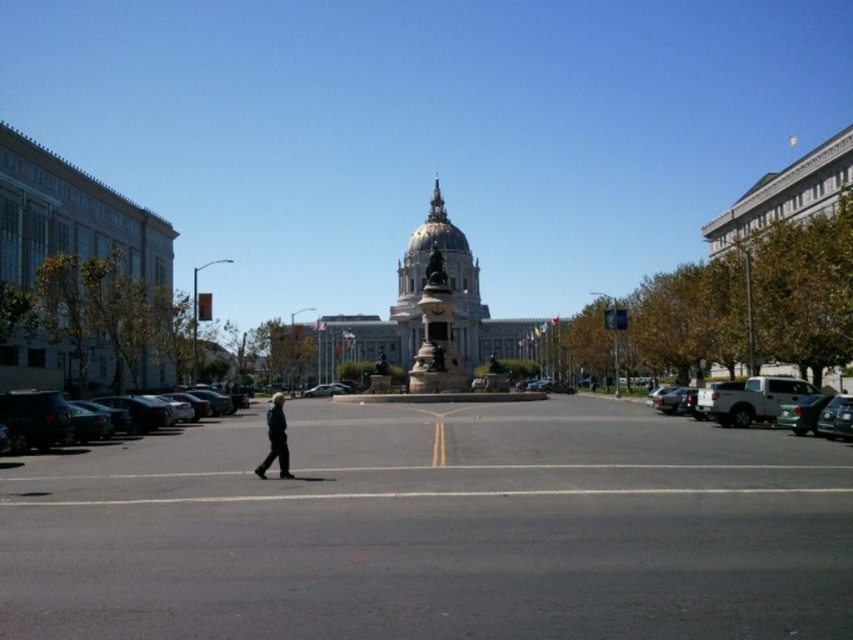
Consider the image. You are a photographer planning to take a photo of the gold textured spire at center and the metallic silver sedan at center from the pedestrian crossing. Which object will appear bigger in your photo?

The gold textured spire at center will appear bigger in the photo because it is larger in size than the metallic silver sedan at center.

You are a photographer planning to take a picture of the gold textured spire at center and the metallic silver sedan at center from the same spot. Which object will appear larger in the photo?

The gold textured spire at center will appear larger in the photo because it is much taller than the metallic silver sedan at center.